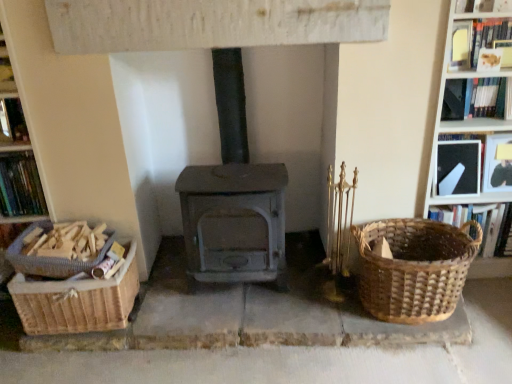
Question: From the image's perspective, does black paper at upper right, the 3th book when ordered from right to left, appear lower than brown woven basket at right, which is the 1th basket in right-to-left order?

Choices:
 (A) no
 (B) yes

Answer: (A)

Question: Is black paper at upper right, the 3th book when ordered from right to left, positioned behind brown woven basket at right, which is the 1th basket in right-to-left order?

Choices:
 (A) no
 (B) yes

Answer: (B)

Question: Is black paper at upper right, the 3th book when ordered from right to left, oriented towards brown woven basket at right, the second basket viewed from the left?

Choices:
 (A) no
 (B) yes

Answer: (A)

Question: Is black paper at upper right, the 3th book when ordered from right to left, to the right of brown woven basket at right, the second basket viewed from the left, from the viewer's perspective?

Choices:
 (A) yes
 (B) no

Answer: (A)

Question: From the image's perspective, is black paper at upper right, placed as the 5th book when sorted from left to right, above brown woven basket at right, which is the 1th basket in right-to-left order?

Choices:
 (A) yes
 (B) no

Answer: (A)

Question: Is brown woven basket at right, the second basket viewed from the left, inside or outside of hardcover book at upper right, the fourth book in the right-to-left sequence?

Choices:
 (A) inside
 (B) outside

Answer: (B)

Question: From a real-world perspective, is brown woven basket at right, which is the 1th basket in right-to-left order, positioned above or below hardcover book at upper right, the fourth book in the right-to-left sequence?

Choices:
 (A) below
 (B) above

Answer: (A)

Question: From the image's perspective, is brown woven basket at right, the second basket viewed from the left, above or below hardcover book at upper right, which is counted as the fourth book, starting from the left?

Choices:
 (A) above
 (B) below

Answer: (B)

Question: Considering the positions of brown woven basket at right, which is the 1th basket in right-to-left order, and hardcover book at upper right, which is counted as the fourth book, starting from the left, in the image, is brown woven basket at right, which is the 1th basket in right-to-left order, bigger or smaller than hardcover book at upper right, which is counted as the fourth book, starting from the left,?

Choices:
 (A) big
 (B) small

Answer: (A)

Question: Considering the relative positions of hardcover book at upper right, the fourth book in the right-to-left sequence, and woven brown basket at lower left in the image provided, is hardcover book at upper right, the fourth book in the right-to-left sequence, to the left or to the right of woven brown basket at lower left?

Choices:
 (A) right
 (B) left

Answer: (A)

Question: Is hardcover book at upper right, the fourth book in the right-to-left sequence, inside or outside of woven brown basket at lower left?

Choices:
 (A) inside
 (B) outside

Answer: (B)

Question: Is hardcover book at upper right, which is counted as the fourth book, starting from the left, wider or thinner than woven brown basket at lower left?

Choices:
 (A) thin
 (B) wide

Answer: (A)

Question: Is hardcover book at upper right, which is counted as the fourth book, starting from the left, bigger or smaller than woven brown basket at lower left?

Choices:
 (A) small
 (B) big

Answer: (A)

Question: From the image's perspective, is woven brown basket at lower left positioned above or below black paper at upper right, the 3th book when ordered from right to left?

Choices:
 (A) below
 (B) above

Answer: (A)

Question: From their relative heights in the image, would you say woven brown basket at lower left is taller or shorter than black paper at upper right, the 3th book when ordered from right to left?

Choices:
 (A) short
 (B) tall

Answer: (A)